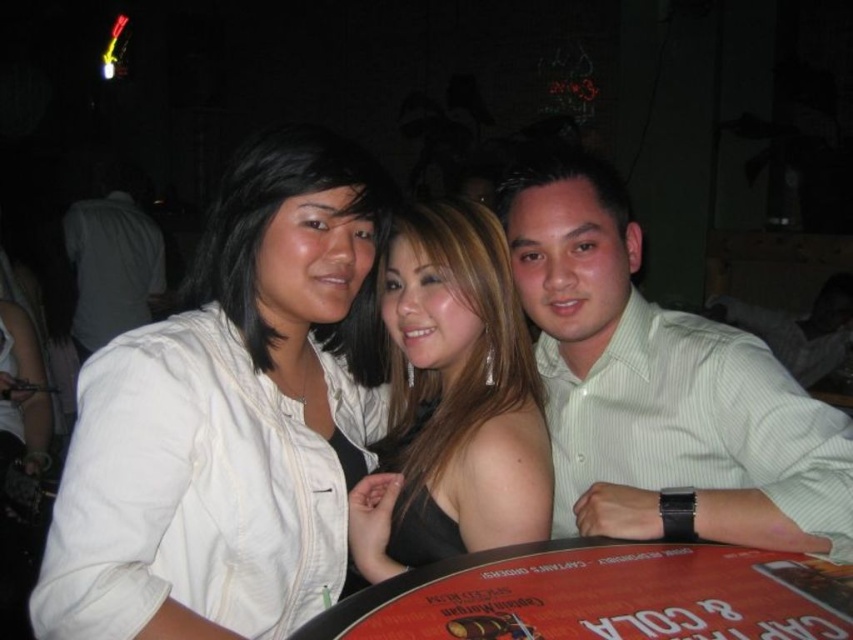
You are at a social event and want to place a drink on the wooden table at center without spilling it. The green striped shirt at right is leaning over. Is the table still accessible?

The green striped shirt at right is located above the wooden table at center, which means the person wearing the green striped shirt is leaning over the table. This could block access to part of the table, so placing a drink there might risk spilling if the person moves. Consider choosing a different spot.

You are at a social gathering and want to take a photo with the green striped shirt at right and the wooden table at center. Which object is bigger?

The green striped shirt at right is larger in size than the wooden table at center.